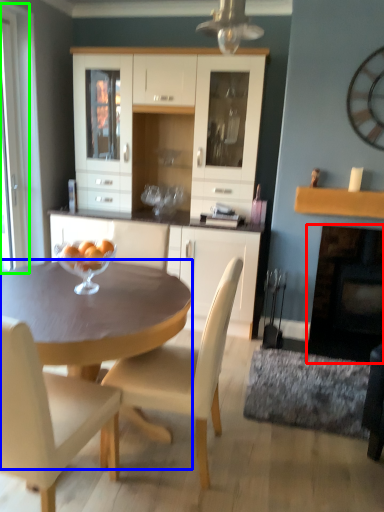
Question: Considering the real-world distances, which object is farthest from fireplace (highlighted by a red box)? desk (highlighted by a blue box) or screen door (highlighted by a green box)?

Choices:
 (A) desk
 (B) screen door

Answer: (B)